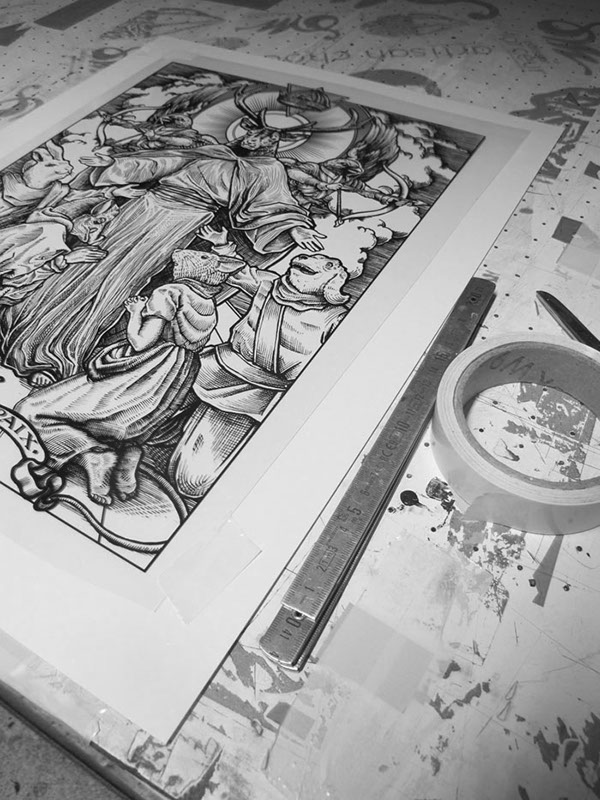
Locate an element on the screen. artwork is located at coordinates (209, 205).